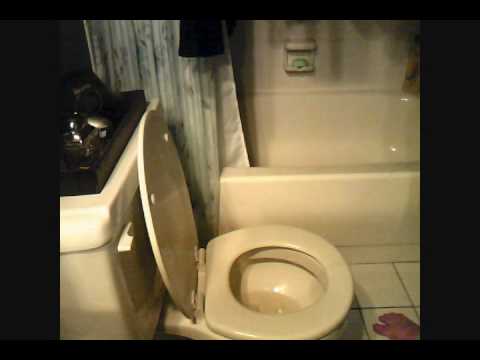
You are a GUI agent. You are given a task and a screenshot of the screen. Output one action in this format:
    pyautogui.click(x=<x>, y=<y>)
    Task: Click on the bath tub
    This screenshot has height=360, width=480.
    Given the screenshot: What is the action you would take?
    pyautogui.click(x=311, y=148)